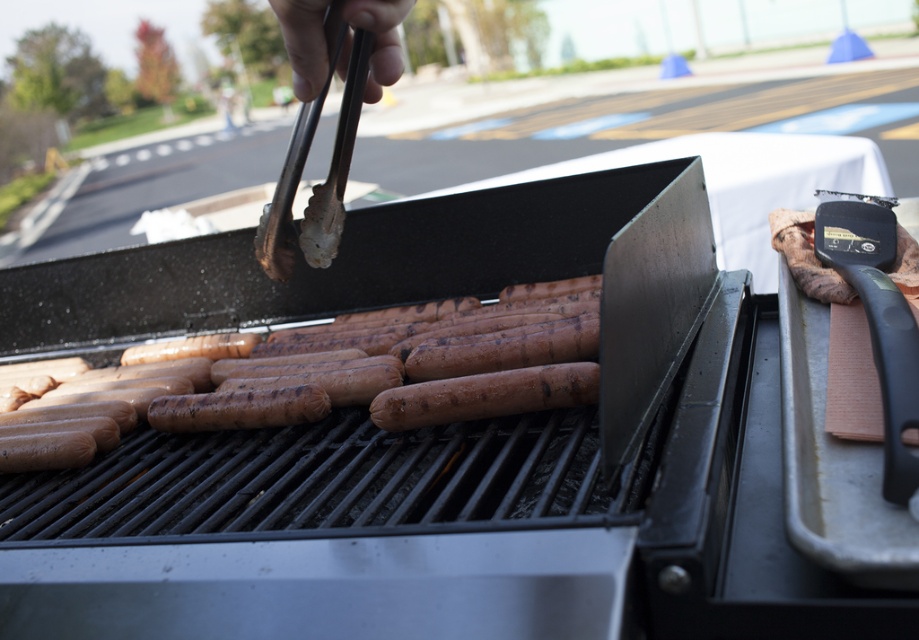
You are taking a photo of the barbecue grill and want to focus on both the point at coordinates point (426, 330) and the point at coordinates point (917, 362). Which point is closer to your camera lens?

A: Point (426, 330) is closer to the camera lens than point (917, 362).

You are a food safety inspector and need to check the temperature of the brown matte hot dog at center. Your thermometer has a 24 inch probe. Can you reach the hot dog with the probe from your current position?

The brown matte hot dog at center and viewer are 27.52 inches apart. Since the thermometer probe is only 24 inches long, it cannot reach the hot dog.